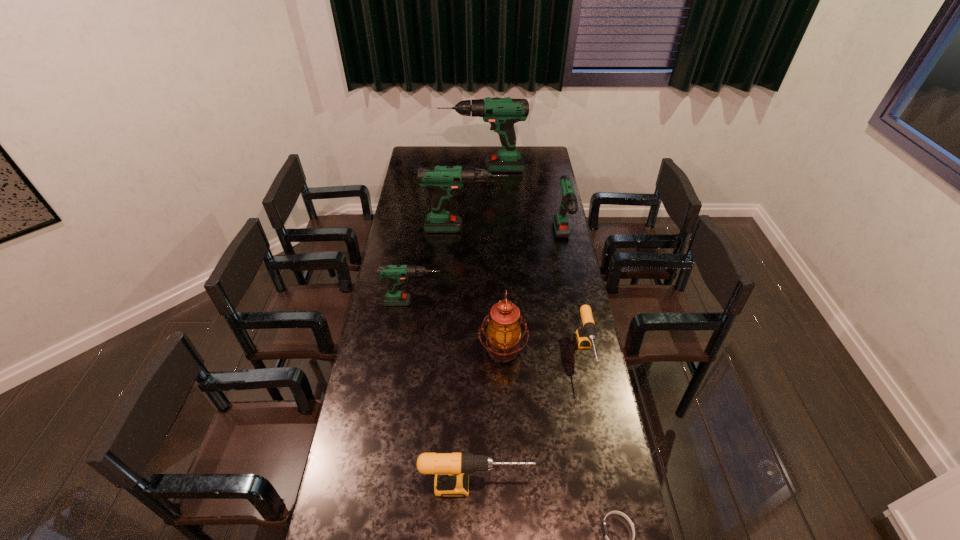
Identify the location of object that can be found as the seventh closest to the nearest object. (502, 113).

Point out which object is positioned as the sixth nearest to the left black drill. Please provide its 2D coordinates. Your answer should be formatted as a tuple, i.e. [(x, y)], where the tuple contains the x and y coordinates of a point satisfying the conditions above.

[(444, 180)]

Point out which drill is positioned as the fifth nearest to the farthest drill. Please provide its 2D coordinates. Your answer should be formatted as a tuple, i.e. [(x, y)], where the tuple contains the x and y coordinates of a point satisfying the conditions above.

[(452, 470)]

Select which drill is the fourth closest to the smaller black drill. Please provide its 2D coordinates. Your answer should be formatted as a tuple, i.e. [(x, y)], where the tuple contains the x and y coordinates of a point satisfying the conditions above.

[(444, 180)]

Locate an element on the screen. The width and height of the screenshot is (960, 540). the third closest green drill to the oil lamp is located at coordinates (444, 180).

Select which green drill appears as the closest to the second shortest object. Please provide its 2D coordinates. Your answer should be formatted as a tuple, i.e. [(x, y)], where the tuple contains the x and y coordinates of a point satisfying the conditions above.

[(569, 204)]